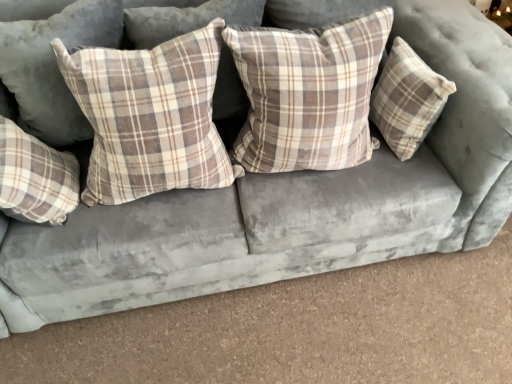
Question: Is plaid fabric pillow at center, arranged as the 2th pillow when viewed from the right, to the left or to the right of plaid fabric pillow at left, which is the 2th pillow in left-to-right order, in the image?

Choices:
 (A) right
 (B) left

Answer: (A)

Question: From a real-world perspective, is plaid fabric pillow at center, arranged as the 2th pillow when viewed from the right, positioned above or below plaid fabric pillow at left, which is counted as the fourth pillow, starting from the right?

Choices:
 (A) below
 (B) above

Answer: (B)

Question: Considering the real-world distances, which object is farthest from the plaid fabric pillow at left, which is the 2th pillow in left-to-right order?

Choices:
 (A) plaid fabric pillow at right, marked as the first pillow in a right-to-left arrangement
 (B) plaid fabric pillow at upper left, the fifth pillow when ordered from right to left
 (C) plaid fabric pillow at center, arranged as the 2th pillow when viewed from the right
 (D) plaid fabric pillow at center, which is the 3th pillow from right to left

Answer: (A)

Question: Considering the real-world distances, which object is closest to the plaid fabric pillow at center, arranged as the 2th pillow when viewed from the right?

Choices:
 (A) plaid fabric pillow at center, which is the 3th pillow from right to left
 (B) plaid fabric pillow at left, which is counted as the fourth pillow, starting from the right
 (C) plaid fabric pillow at upper left, the fifth pillow when ordered from right to left
 (D) plaid fabric pillow at right, marked as the first pillow in a right-to-left arrangement

Answer: (D)